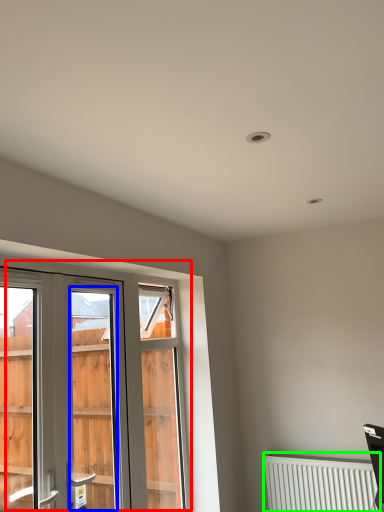
Question: Based on their relative distances, which object is nearer to window (highlighted by a red box)? Choose from screen door (highlighted by a blue box) and radiator (highlighted by a green box).

Choices:
 (A) screen door
 (B) radiator

Answer: (B)